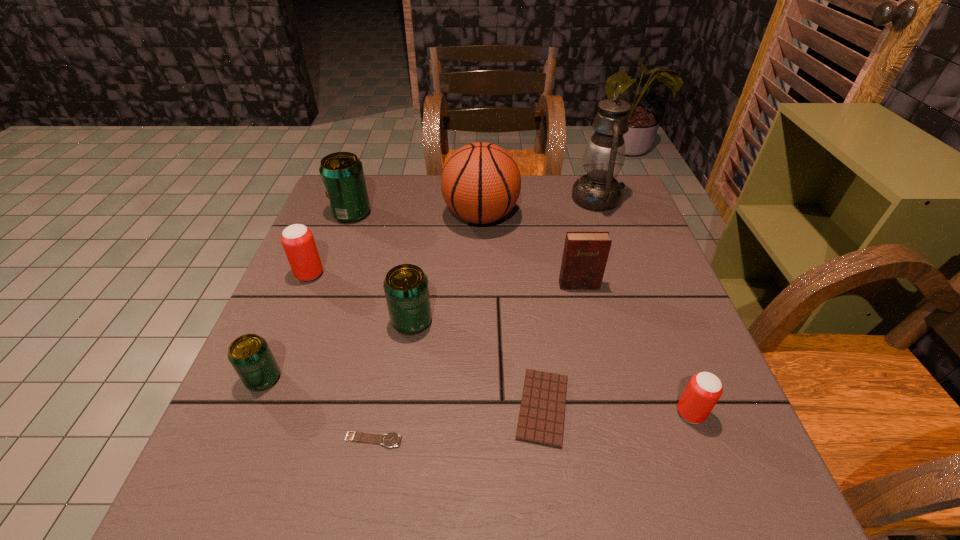
Identify the location of free space at the far left corner of the desktop. (372, 212).

At what (x,y) coordinates should I click in order to perform the action: click on free region at the near right corner of the desktop. Please return your answer as a coordinate pair (x, y). Looking at the image, I should click on (747, 508).

You are a GUI agent. You are given a task and a screenshot of the screen. Output one action in this format:
    pyautogui.click(x=<x>, y=<y>)
    Task: Click on the vacant area that lies between the second smallest green beer can and the second farthest beer can
    This screenshot has width=960, height=540.
    Given the screenshot: What is the action you would take?
    pyautogui.click(x=361, y=298)

Where is `vacant point located between the rightmost beer can and the fourth farthest beer can`? This screenshot has height=540, width=960. vacant point located between the rightmost beer can and the fourth farthest beer can is located at coordinates (477, 396).

This screenshot has width=960, height=540. I want to click on unoccupied area between the second tallest object and the shortest object, so click(x=427, y=328).

Locate an element on the screen. free area in between the bigger red beer can and the fifth nearest object is located at coordinates (361, 298).

Identify the location of vacant area that lies between the rightmost beer can and the orange basketball. The height and width of the screenshot is (540, 960). (586, 315).

The height and width of the screenshot is (540, 960). Identify the location of empty space between the nearest green beer can and the right red beer can. (477, 396).

Image resolution: width=960 pixels, height=540 pixels. What are the coordinates of `free space between the left red beer can and the reddish-brown diary` in the screenshot? It's located at (444, 280).

Identify the location of free space between the farthest green beer can and the right red beer can. (521, 313).